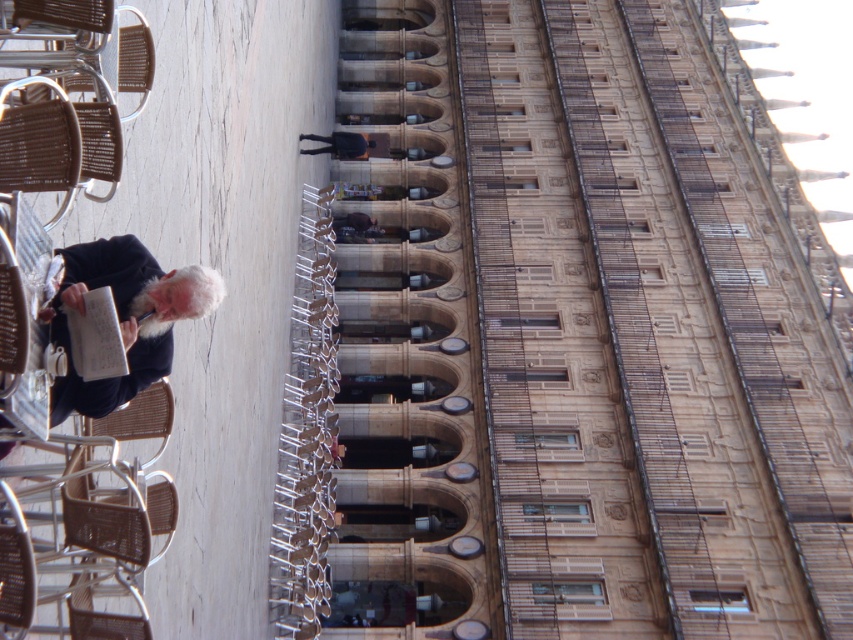
You are standing at the point labeled as point (x=146, y=436) in the public square. There is a historical building in the background. If you want to walk towards the point labeled as point (x=207, y=275), which direction should you move relative to your current position?

You should move forward because point (x=207, y=275) is in front of point (x=146, y=436).

You are standing in the public square and notice a specific point marked at coordinates point (125, 317). What color is the fabric located at that point?

The point (125, 317) is on dark blue fabric at lower left.

You are a visitor in the public square and want to sit down. There are two chairs available here. Which chair, the woven brown chair at lower left or the brown woven chair at lower left, is bigger and more comfortable?

The woven brown chair at lower left is larger in size compared to the brown woven chair at lower left, so it is bigger and more comfortable.